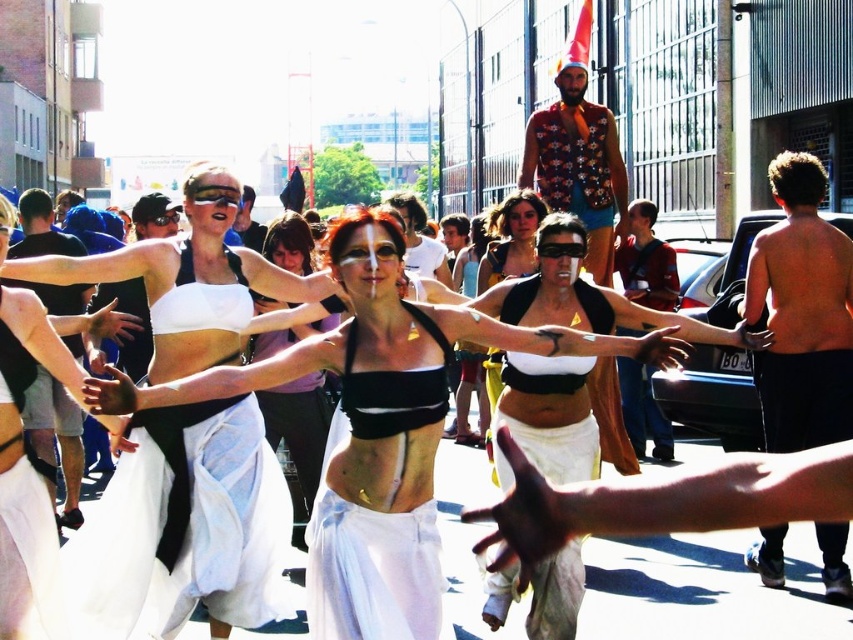
You are a photographer standing at the center of the street. You want to take a photo of the black fabric shorts at left. Where should you position your camera to capture the shorts in the frame?

You should position your camera to the left side of the scene to capture the black fabric shorts at left, as they are located at point (57,438) in the image.

You are a photographer standing in the street scene. You want to take a photo that includes both the black fabric shorts at left and the shiny metallic helmet at center. Which object should you focus on first to ensure both are in the frame?

The black fabric shorts at left is closer to the viewer than the shiny metallic helmet at center, so you should focus on the black fabric shorts at left first to ensure both are in the frame.

You are a photographer standing at the edge of the street. You want to take a photo of both the black matte bikini top at center and the matte black tank top at center in the same frame. Given that your camera has a maximum focus range of 10 meters, will you be able to capture both objects clearly in the photo?

The black matte bikini top at center is 9.86 meters away from the matte black tank top at center. Since the distance between them is within the camera maximum focus range of 10 meters, you can capture both objects clearly in the same frame.